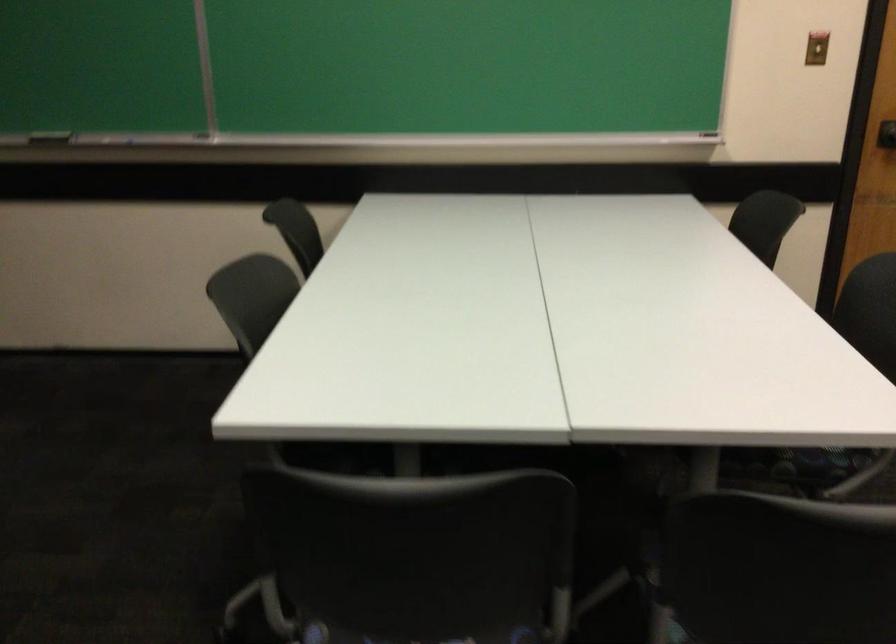
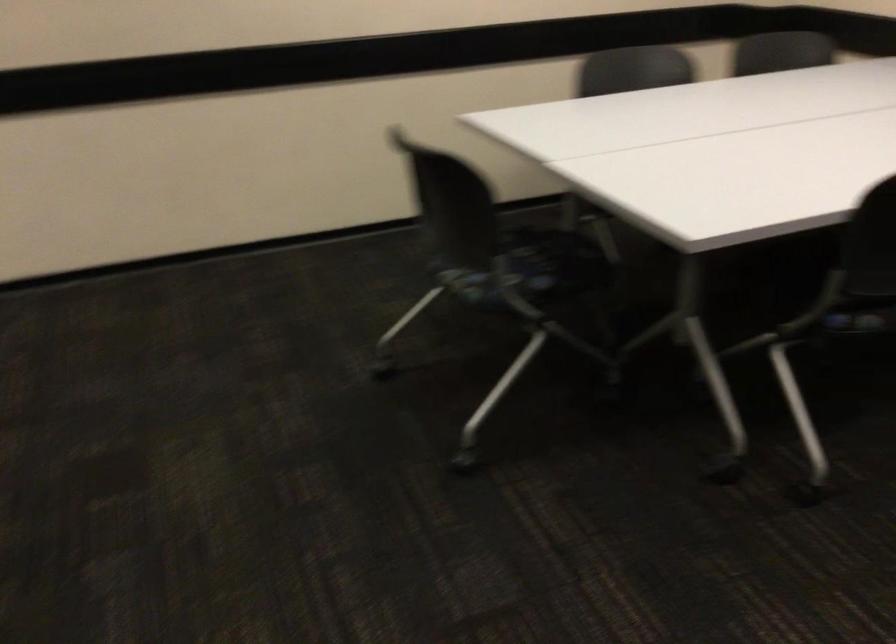
Based on the photo, the first image is from the beginning of the video and the second image is from the end. How did the camera likely rotate when shooting the video?

The camera's rotation is toward right-down.